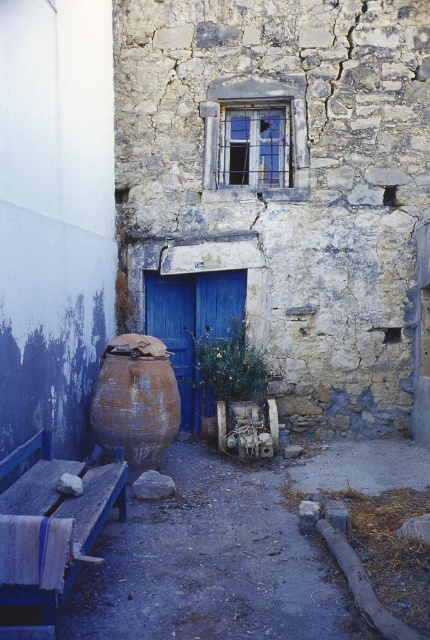
Question: Is blue painted wood bench at lower left to the left of blue matte door at center from the viewer's perspective?

Choices:
 (A) no
 (B) yes

Answer: (B)

Question: Among these objects, which one is farthest from the camera?

Choices:
 (A) blue painted wood bench at lower left
 (B) blue matte door at center

Answer: (B)

Question: Observing the image, what is the correct spatial positioning of blue painted wood bench at lower left in reference to blue matte door at center?

Choices:
 (A) above
 (B) below

Answer: (B)

Question: Does blue painted wood bench at lower left appear over blue matte door at center?

Choices:
 (A) no
 (B) yes

Answer: (A)

Question: Which object appears farthest from the camera in this image?

Choices:
 (A) blue painted wood bench at lower left
 (B) blue matte door at center

Answer: (B)